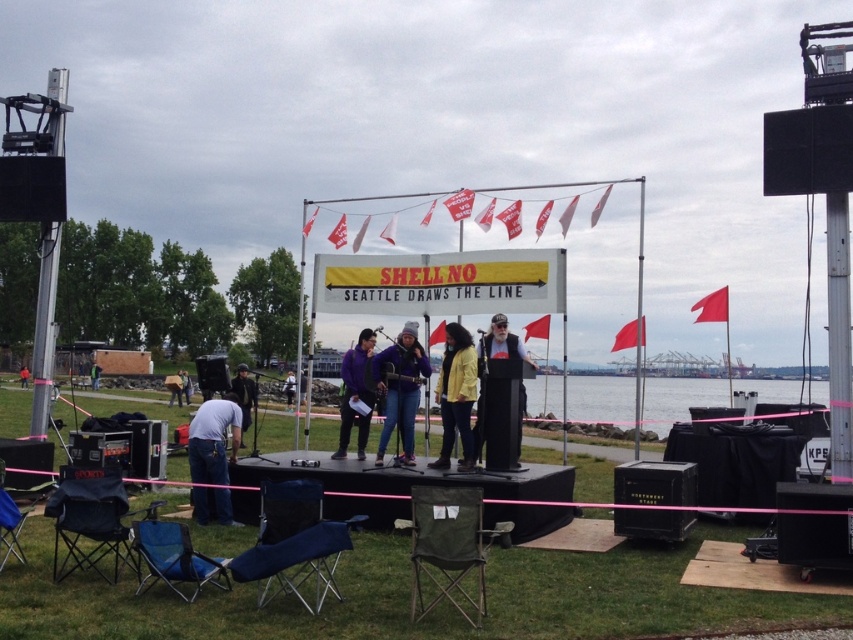
From the picture: You are a photographer at the event and need to capture a clear shot of the denim pants at center and the blue fabric chair at lower left. Which object will appear bigger in your photo?

The denim pants at center will appear bigger in the photo since it is larger in size than the blue fabric chair at lower left.

You are a photographer at the event and want to capture a photo of the denim pants at center and the blue fabric chair at lower left. Which object is positioned higher in the image?

The denim pants at center is located above the blue fabric chair at lower left, so it is positioned higher in the image.

You are at the waterfront event and need to locate the denim pants at center. Which direction should you look relative to the blue fabric chair at lower left?

The denim pants at center are to the right of the blue fabric chair at lower left.